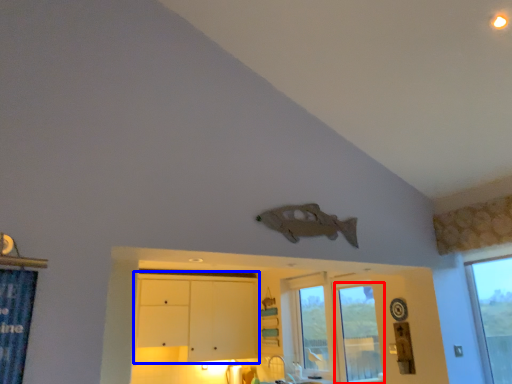
Question: Which point is further to the camera, window (highlighted by a red box) or dresser (highlighted by a blue box)?

Choices:
 (A) window
 (B) dresser

Answer: (B)